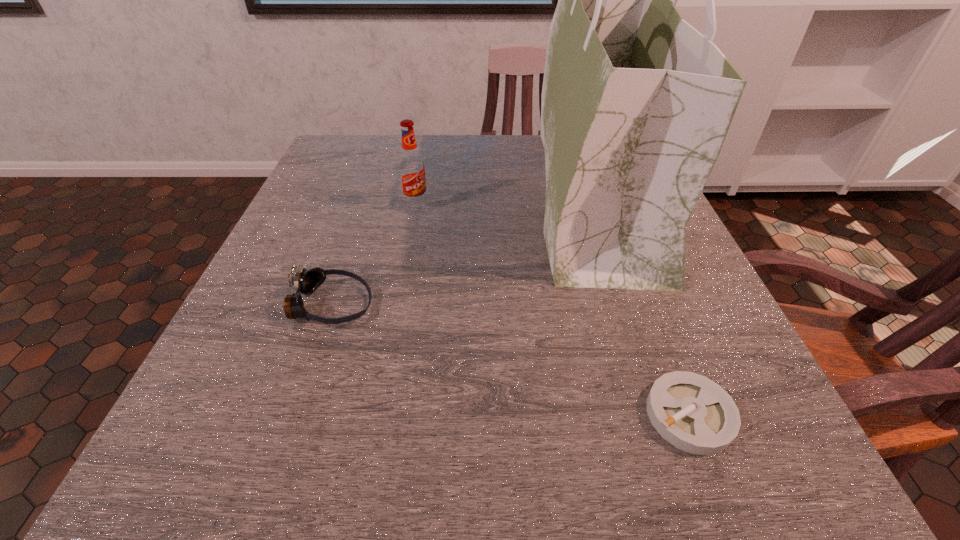
I want to click on vacant position located 0.400m on the back of the ashtray, so click(x=614, y=218).

Identify the location of object located at the far edge. (636, 103).

Image resolution: width=960 pixels, height=540 pixels. What are the coordinates of `object located at the near edge` in the screenshot? It's located at (693, 413).

Find the location of a particular element. object positioned at the left edge is located at coordinates (305, 282).

You are a GUI agent. You are given a task and a screenshot of the screen. Output one action in this format:
    pyautogui.click(x=<x>, y=<y>)
    Task: Click on the grocery bag at the right edge
    The height and width of the screenshot is (540, 960).
    Given the screenshot: What is the action you would take?
    pyautogui.click(x=636, y=103)

Where is `ashtray present at the right edge`? ashtray present at the right edge is located at coordinates (693, 413).

At what (x,y) coordinates should I click in order to perform the action: click on object present at the far right corner. Please return your answer as a coordinate pair (x, y). Looking at the image, I should click on (636, 103).

This screenshot has height=540, width=960. Find the location of `object that is at the near right corner`. object that is at the near right corner is located at coordinates (693, 413).

Identify the location of blank area at the far edge. (504, 181).

Identify the location of free space at the left edge of the desktop. (265, 289).